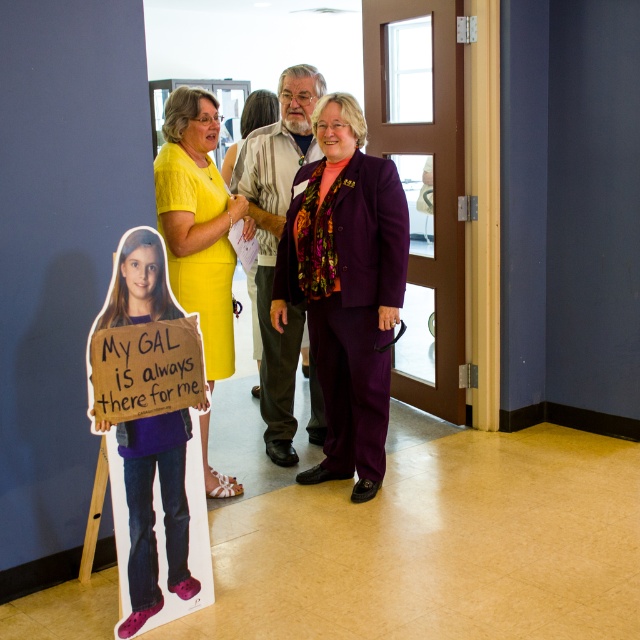
Is purple satin suit at center below purple fabric suit at center?

Actually, purple satin suit at center is above purple fabric suit at center.

Can you confirm if purple satin suit at center is smaller than purple fabric suit at center?

No, purple satin suit at center is not smaller than purple fabric suit at center.

Is point (352, 349) positioned before point (125, 636)?

No, it is behind (125, 636).

This screenshot has height=640, width=640. Identify the location of purple satin suit at center. (346, 289).

Between point (148, 534) and point (163, 125), which one is positioned behind?

Positioned behind is point (163, 125).

Does purple fabric suit at center appear on the left side of yellow fabric dress at center?

Yes, purple fabric suit at center is to the left of yellow fabric dress at center.

Does point (182, 604) come farther from viewer compared to point (216, 196)?

No, it is not.

Where is `purple fabric suit at center`? purple fabric suit at center is located at coordinates (161, 518).

Can you confirm if purple fabric suit at center is positioned to the right of multicolored patterned suit at center?

Incorrect, purple fabric suit at center is not on the right side of multicolored patterned suit at center.

Does purple fabric suit at center have a greater width compared to multicolored patterned suit at center?

No, purple fabric suit at center is not wider than multicolored patterned suit at center.

Who is more forward, (x=179, y=460) or (x=276, y=390)?

Point (x=179, y=460) is more forward.

You are a GUI agent. You are given a task and a screenshot of the screen. Output one action in this format:
    pyautogui.click(x=<x>, y=<y>)
    Task: Click on the purple fabric suit at center
    This screenshot has width=640, height=640.
    Given the screenshot: What is the action you would take?
    pyautogui.click(x=161, y=518)